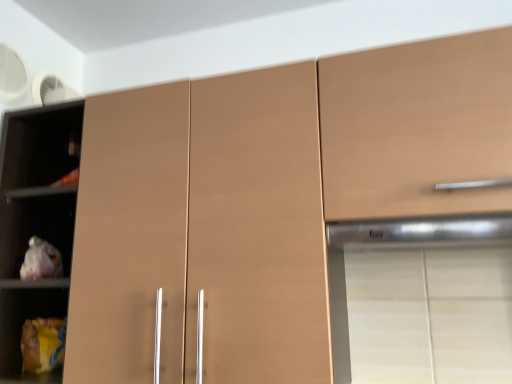
Question: In terms of width, does matte brown cupboard at left look wider or thinner when compared to satin silver exhaust hood at upper right?

Choices:
 (A) wide
 (B) thin

Answer: (B)

Question: Choose the correct answer: Is matte brown cupboard at left inside satin silver exhaust hood at upper right or outside it?

Choices:
 (A) inside
 (B) outside

Answer: (B)

Question: Which object is the farthest from the matte brown cupboard at left?

Choices:
 (A) satin silver exhaust hood at upper right
 (B) matte brown cabinet at upper right

Answer: (A)

Question: Which is farther from the matte brown cabinet at upper right?

Choices:
 (A) satin silver exhaust hood at upper right
 (B) matte brown cupboard at left

Answer: (B)